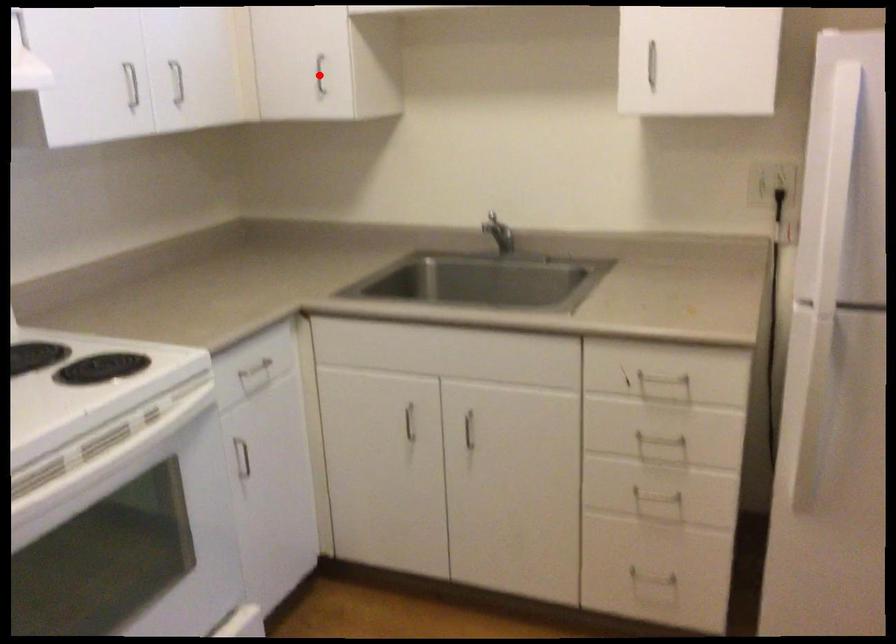
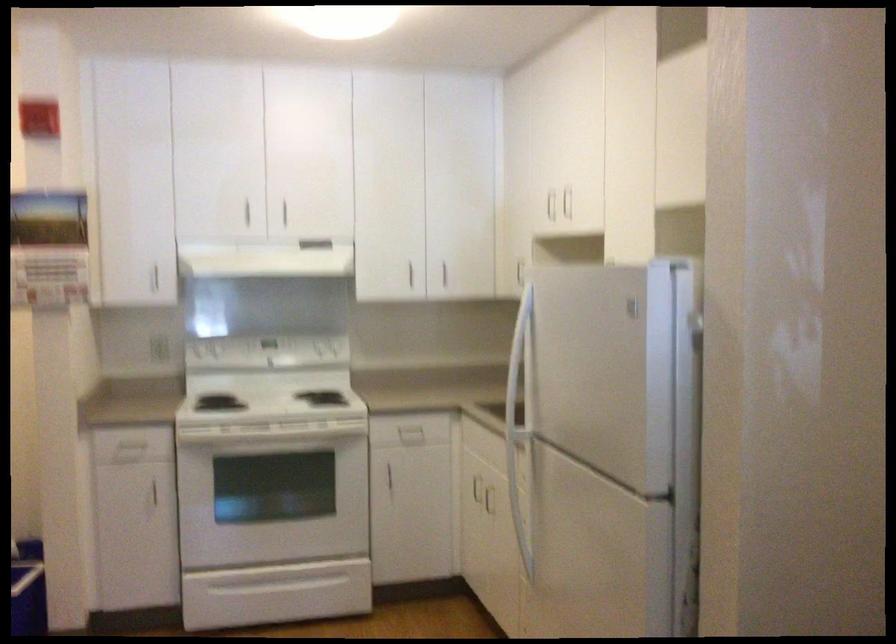
Question: I am providing you with two images of the same scene from different viewpoints. A red point is marked on the first image. At the location where the point appears in image 1, is it still visible in image 2?

Choices:
 (A) Yes
 (B) No

Answer: (B)